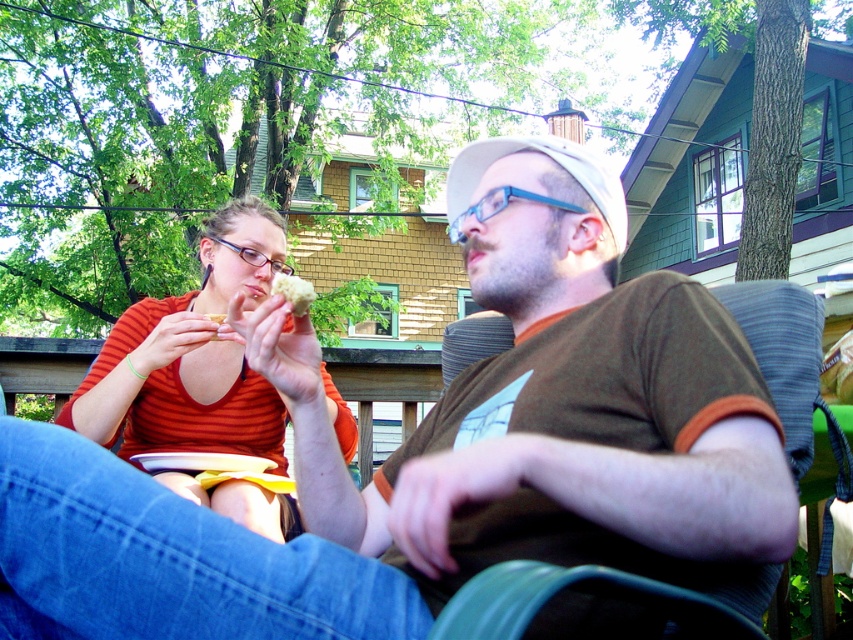
You are a food inspector checking the bread items in the image. The white crumbly bread at center and yellow crumbly bread at upper center are both on a wooden bench. Which bread has a smaller width?

The white crumbly bread at center has a lesser width compared to the yellow crumbly bread at upper center, so the white crumbly bread at center is smaller in width.

You are a food delivery person who needs to deliver two types of bread to a customer. The customer has a small oven that can only accommodate items up to 5 inches in height. You observe the white crumbly bread at center and the yellow crumbly bread at upper center in the image. Can both types of bread fit into the oven vertically without exceeding the height limit?

The white crumbly bread at center is taller than the yellow crumbly bread at upper center. Since the oven can only accommodate items up to 5 inches in height, we need to check the height of both breads. However, the exact heights are not provided. Therefore, it is uncertain if both will fit without exceeding the limit.